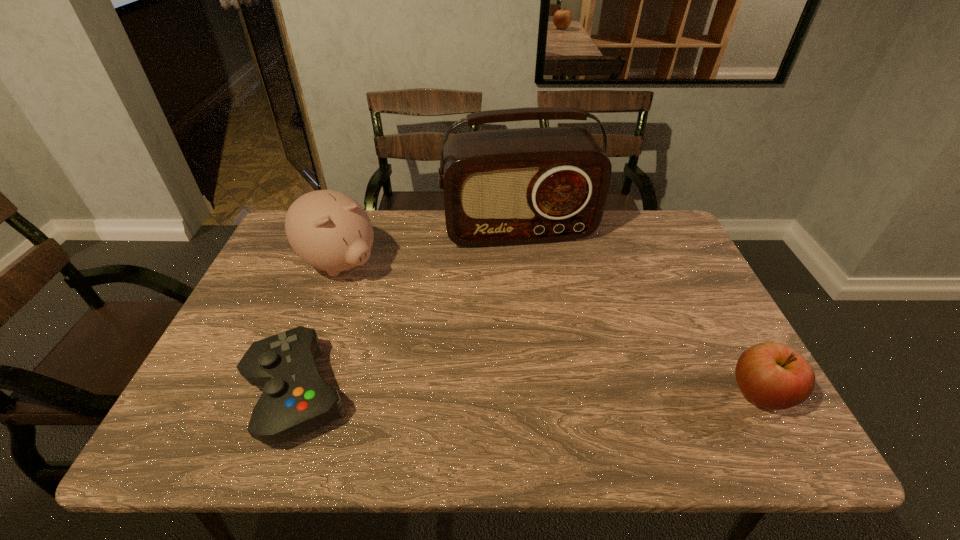
Image resolution: width=960 pixels, height=540 pixels. What are the coordinates of `free spot at the near right corner of the desktop` in the screenshot? It's located at (729, 407).

Where is `vacant area between the tallest object and the third shortest object`? Image resolution: width=960 pixels, height=540 pixels. vacant area between the tallest object and the third shortest object is located at coordinates (429, 247).

The width and height of the screenshot is (960, 540). Find the location of `blank region between the second object from right to left and the third tallest object`. blank region between the second object from right to left and the third tallest object is located at coordinates (639, 312).

The image size is (960, 540). I want to click on unoccupied position between the third tallest object and the third shortest object, so click(550, 328).

You are a GUI agent. You are given a task and a screenshot of the screen. Output one action in this format:
    pyautogui.click(x=<x>, y=<y>)
    Task: Click on the free spot between the second shortest object and the tallest object
    
    Given the screenshot: What is the action you would take?
    [x=639, y=312]

At what (x,y) coordinates should I click in order to perform the action: click on vacant point located between the control and the piggy bank. Please return your answer as a coordinate pair (x, y). Looking at the image, I should click on (318, 328).

Where is `vacant point located between the rightmost object and the tallest object`? The height and width of the screenshot is (540, 960). vacant point located between the rightmost object and the tallest object is located at coordinates (639, 312).

At what (x,y) coordinates should I click in order to perform the action: click on empty location between the third shortest object and the rightmost object. Please return your answer as a coordinate pair (x, y). Looking at the image, I should click on (550, 328).

Locate an element on the screen. The image size is (960, 540). vacant region between the third tallest object and the second object from right to left is located at coordinates (639, 312).

Locate an element on the screen. vacant area that lies between the rightmost object and the tallest object is located at coordinates (639, 312).